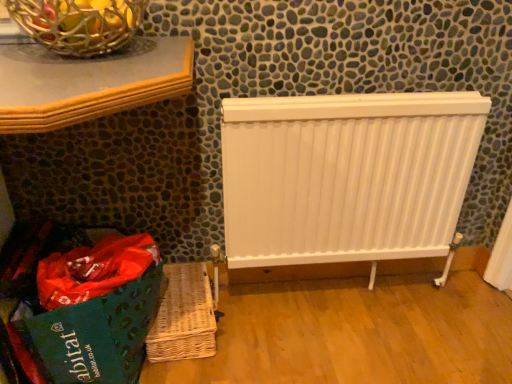
At what (x,y) coordinates should I click in order to perform the action: click on vacant space underneath white matte radiator at center (from a real-world perspective). Please return your answer as a coordinate pair (x, y). This screenshot has height=384, width=512. Looking at the image, I should click on (338, 287).